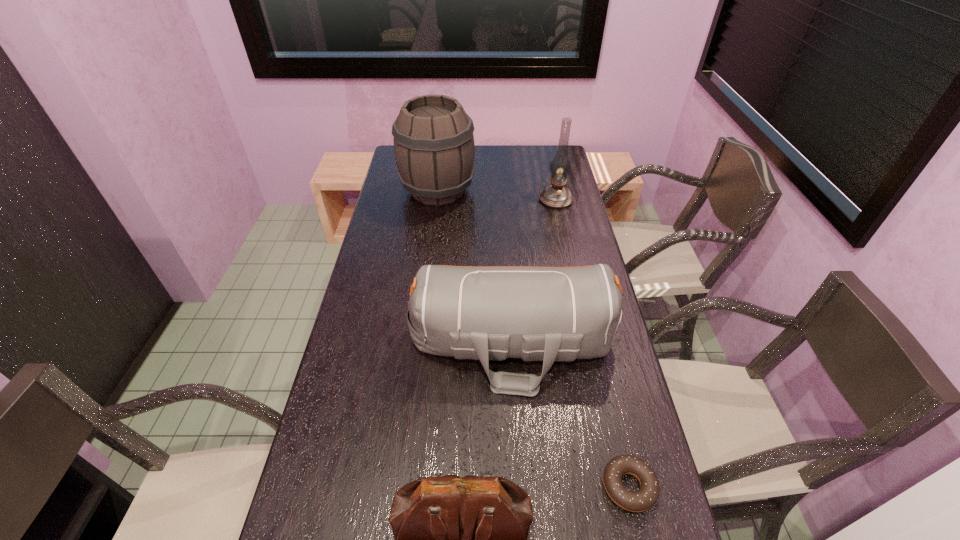
Find the location of a particular element. This screenshot has width=960, height=540. wine bucket is located at coordinates point(434,148).

Where is `oil lamp`? This screenshot has height=540, width=960. oil lamp is located at coordinates (557, 196).

I want to click on the third farthest object, so click(x=552, y=314).

Identify the location of the shortest object. (643, 499).

The image size is (960, 540). Find the location of `blank space located 0.270m on the right of the wine bucket`. blank space located 0.270m on the right of the wine bucket is located at coordinates (541, 191).

You are a GUI agent. You are given a task and a screenshot of the screen. Output one action in this format:
    pyautogui.click(x=<x>, y=<y>)
    Task: Click on the vacant area located on the back of the oil lamp
    The width and height of the screenshot is (960, 540).
    Given the screenshot: What is the action you would take?
    pyautogui.click(x=544, y=150)

Locate an element on the screen. free region located on the front of the duffel bag is located at coordinates (519, 448).

Where is `free space located on the back of the doughnut`? free space located on the back of the doughnut is located at coordinates (596, 347).

At what (x,y) coordinates should I click in order to perform the action: click on object present at the far edge. Please return your answer as a coordinate pair (x, y). Looking at the image, I should click on (434, 148).

You are a GUI agent. You are given a task and a screenshot of the screen. Output one action in this format:
    pyautogui.click(x=<x>, y=<y>)
    Task: Click on the object at the left edge
    
    Given the screenshot: What is the action you would take?
    pyautogui.click(x=434, y=148)